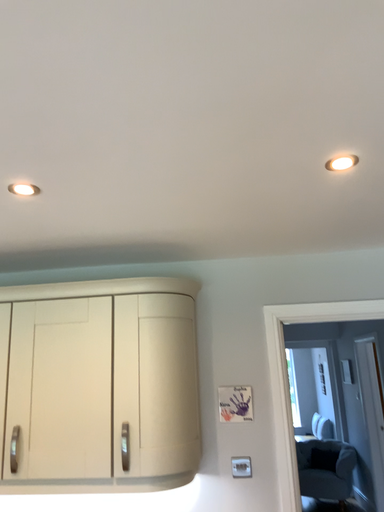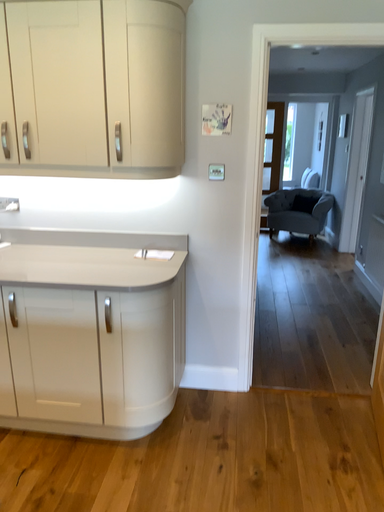
Question: How did the camera likely rotate when shooting the video?

Choices:
 (A) rotated downward
 (B) rotated upward

Answer: (A)